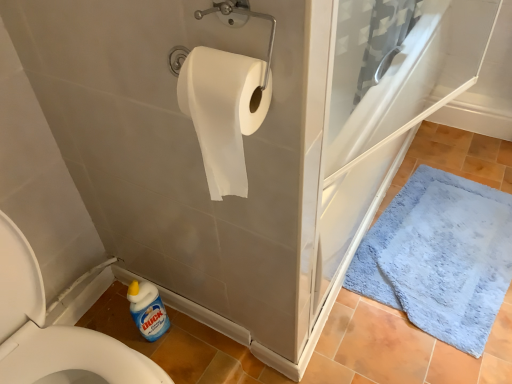
Question: Does point (216, 152) appear closer or farther from the camera than point (147, 284)?

Choices:
 (A) closer
 (B) farther

Answer: (A)

Question: Is white matte toilet paper at upper center wider or thinner than blue plastic bottle at lower left?

Choices:
 (A) thin
 (B) wide

Answer: (B)

Question: Considering the real-world distances, which object is farthest from the blue plastic bottle at lower left?

Choices:
 (A) blue plush bath mat at lower right
 (B) white matte toilet paper at upper center
 (C) white paper towel at left

Answer: (A)

Question: Which of these objects is positioned closest to the white matte toilet paper at upper center?

Choices:
 (A) blue plastic bottle at lower left
 (B) blue plush bath mat at lower right
 (C) white paper towel at left

Answer: (C)